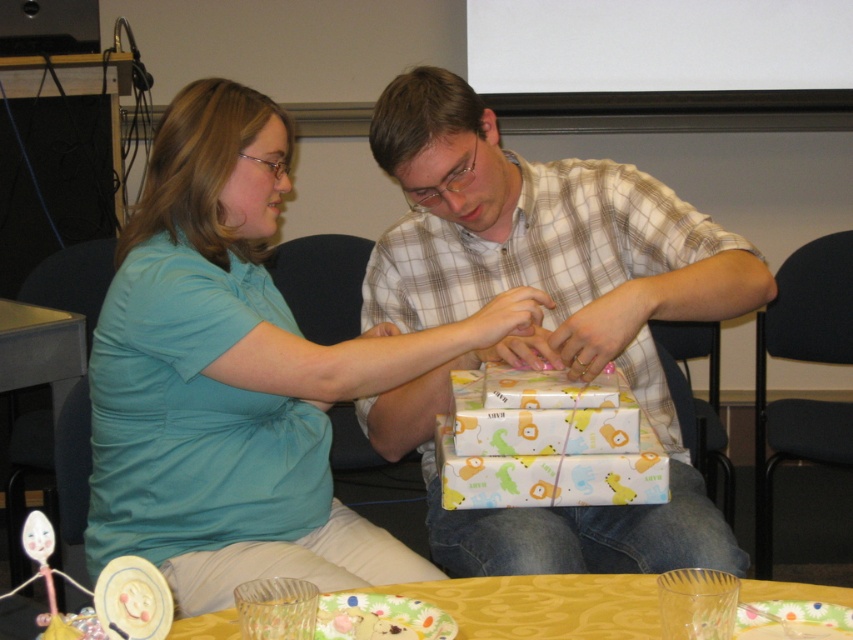
Question: Estimate the real-world distances between objects in this image. Which object is closer to the plaid shirt at center?

Choices:
 (A) yellow fabric table at lower center
 (B) matte teal shirt at center

Answer: (B)

Question: Considering the real-world distances, which object is closest to the yellow fabric table at lower center?

Choices:
 (A) plaid shirt at center
 (B) matte teal shirt at center

Answer: (B)

Question: Does plaid shirt at center come in front of yellow fabric table at lower center?

Choices:
 (A) yes
 (B) no

Answer: (B)

Question: Estimate the real-world distances between objects in this image. Which object is farther from the plaid shirt at center?

Choices:
 (A) yellow fabric table at lower center
 (B) matte teal shirt at center

Answer: (A)

Question: Observing the image, what is the correct spatial positioning of plaid shirt at center in reference to yellow fabric table at lower center?

Choices:
 (A) above
 (B) below

Answer: (A)

Question: Is matte teal shirt at center to the right of yellow fabric table at lower center from the viewer's perspective?

Choices:
 (A) yes
 (B) no

Answer: (B)